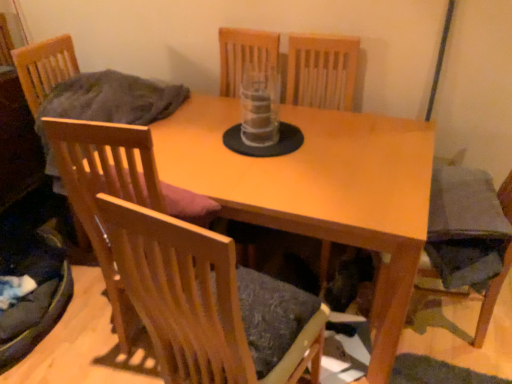
Question: Considering the positions of point click(x=244, y=357) and point click(x=241, y=206), is point click(x=244, y=357) closer or farther from the camera than point click(x=241, y=206)?

Choices:
 (A) farther
 (B) closer

Answer: (B)

Question: Visually, is wooden chair at center, acting as the third chair starting from the left, positioned to the left or to the right of light wood table at center?

Choices:
 (A) right
 (B) left

Answer: (B)

Question: Which object is positioned closest to the wooden chair at center, acting as the 2th chair starting from the left?

Choices:
 (A) transparent plastic vase at center
 (B) wooden chair at center, which is the 1th chair in right-to-left order
 (C) velvet dark grey armchair at lower right
 (D) light wood table at center
 (E) wooden chair at left, which ranks as the 1th chair in left-to-right order

Answer: (B)

Question: Which is nearer to the transparent plastic vase at center?

Choices:
 (A) light wood table at center
 (B) wooden chair at center, acting as the 2th chair starting from the left
 (C) wooden chair at center, which is the 1th chair in right-to-left order
 (D) wooden chair at left, the 3th chair when ordered from right to left
 (E) velvet dark grey armchair at lower right

Answer: (A)